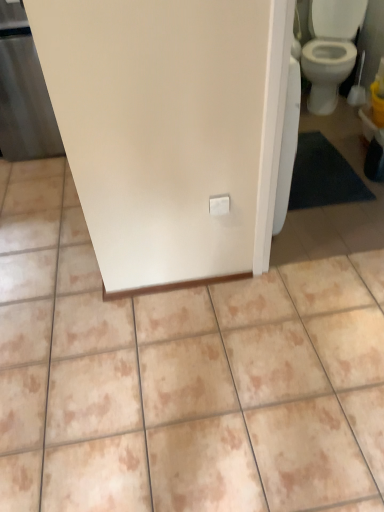
Question: Would you consider matte white screen door at left to be distant from beige ceramic tile at center?

Choices:
 (A) yes
 (B) no

Answer: (A)

Question: Is matte white screen door at left facing away from beige ceramic tile at center?

Choices:
 (A) no
 (B) yes

Answer: (A)

Question: Considering the relative sizes of matte white screen door at left and beige ceramic tile at center in the image provided, is matte white screen door at left wider than beige ceramic tile at center?

Choices:
 (A) no
 (B) yes

Answer: (A)

Question: Can you see matte white screen door at left touching beige ceramic tile at center?

Choices:
 (A) no
 (B) yes

Answer: (A)

Question: Can you confirm if matte white screen door at left is bigger than beige ceramic tile at center?

Choices:
 (A) yes
 (B) no

Answer: (B)

Question: From a real-world perspective, is matte white screen door at left under beige ceramic tile at center?

Choices:
 (A) no
 (B) yes

Answer: (A)

Question: Is beige ceramic tile at center closer to the viewer compared to matte white screen door at left?

Choices:
 (A) no
 (B) yes

Answer: (B)

Question: From a real-world perspective, is beige ceramic tile at center positioned over matte white screen door at left based on gravity?

Choices:
 (A) yes
 (B) no

Answer: (B)

Question: Does beige ceramic tile at center have a greater width compared to matte white screen door at left?

Choices:
 (A) yes
 (B) no

Answer: (A)

Question: From the image's perspective, is beige ceramic tile at center below matte white screen door at left?

Choices:
 (A) no
 (B) yes

Answer: (B)

Question: Can we say beige ceramic tile at center lies outside matte white screen door at left?

Choices:
 (A) yes
 (B) no

Answer: (A)

Question: From a real-world perspective, is beige ceramic tile at center located beneath matte white screen door at left?

Choices:
 (A) yes
 (B) no

Answer: (A)

Question: Would you say beige ceramic tile at center is inside or outside matte white screen door at left?

Choices:
 (A) inside
 (B) outside

Answer: (B)